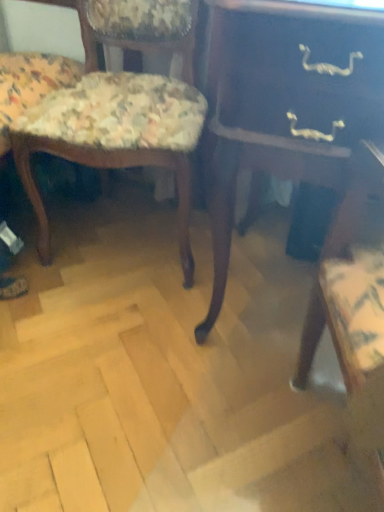
You are a GUI agent. You are given a task and a screenshot of the screen. Output one action in this format:
    pyautogui.click(x=<x>, y=<y>)
    Task: Click on the vacant region under floral fabric chair at left, acting as the 1th chair starting from the right (from a real-world perspective)
    The image size is (384, 512).
    Given the screenshot: What is the action you would take?
    pyautogui.click(x=132, y=233)